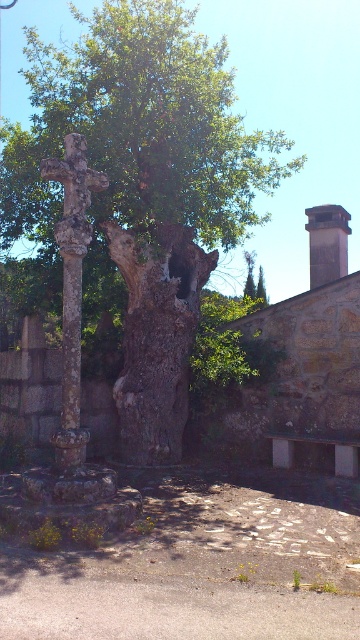
Which is behind, point (74, 460) or point (329, 269)?

Point (329, 269)

Between stone cross at left and smooth gray chimney at upper right, which one is positioned higher?

smooth gray chimney at upper right

What do you see at coordinates (72, 288) in the screenshot? The width and height of the screenshot is (360, 640). I see `stone cross at left` at bounding box center [72, 288].

Locate an element on the screen. The height and width of the screenshot is (640, 360). stone cross at left is located at coordinates (72, 288).

Who is taller, smooth brown tree trunk at center or smooth gray chimney at upper right?

smooth brown tree trunk at center

Between smooth brown tree trunk at center and smooth gray chimney at upper right, which one is positioned higher?

smooth gray chimney at upper right

What do you see at coordinates (156, 337) in the screenshot? The height and width of the screenshot is (640, 360). I see `smooth brown tree trunk at center` at bounding box center [156, 337].

This screenshot has height=640, width=360. What are the coordinates of `smooth brown tree trunk at center` in the screenshot? It's located at (156, 337).

Is point (127, 138) in front of point (162, 401)?

Yes, point (127, 138) is closer to viewer.

Which is behind, point (23, 179) or point (178, 268)?

The point (23, 179) is behind.

In order to click on green rough bark tree at center in this screenshot , I will do `click(146, 184)`.